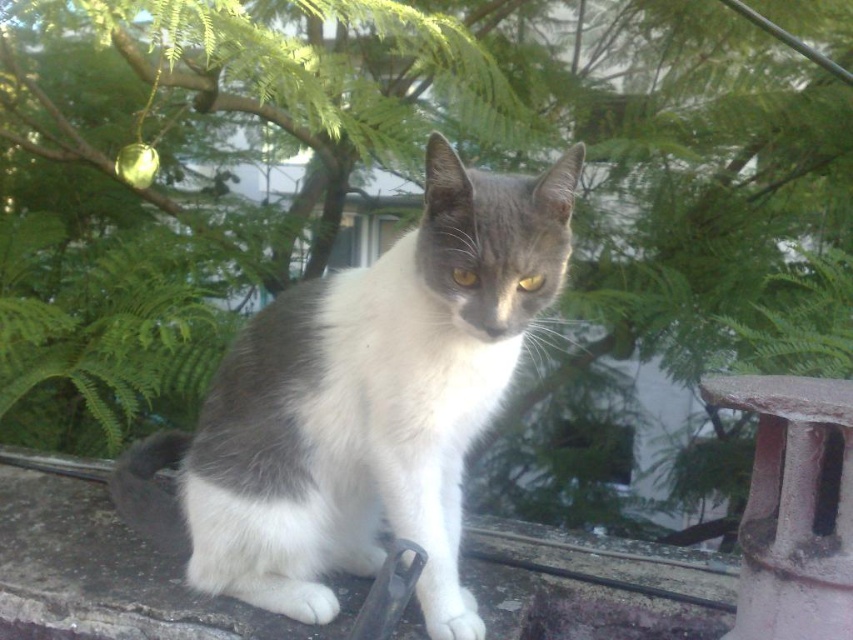
You are a photographer trying to capture the white cat in the scene. The cat is currently at point (363, 404). If you want to position your camera so that the cat is centered in your shot, where should you aim your camera?

You should aim your camera at point (363, 404) to center the white cat in your shot.